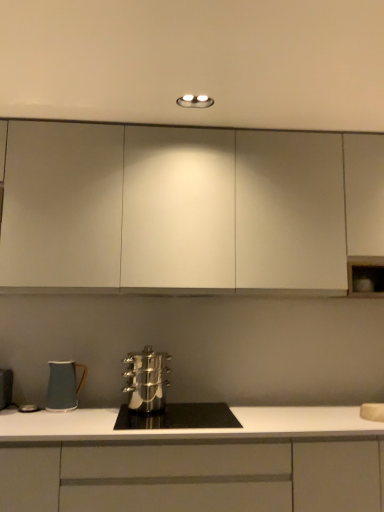
Question: Which direction should I rotate to look at white matte cabinet at center, the second cabinetry viewed from the top, — up or down?

Choices:
 (A) up
 (B) down

Answer: (B)

Question: Are white matte cabinet at center, which is the first cabinetry in bottom-to-top order, and white matte cabinet at upper center, the second cabinetry in the bottom-to-top sequence, far apart?

Choices:
 (A) no
 (B) yes

Answer: (B)

Question: Is white matte cabinet at center, the second cabinetry viewed from the top, facing away from white matte cabinet at upper center, the second cabinetry in the bottom-to-top sequence?

Choices:
 (A) yes
 (B) no

Answer: (B)

Question: Is white matte cabinet at center, which is the first cabinetry in bottom-to-top order, directly adjacent to white matte cabinet at upper center, the first cabinetry in the top-to-bottom sequence?

Choices:
 (A) yes
 (B) no

Answer: (B)

Question: From a real-world perspective, is white matte cabinet at center, the second cabinetry viewed from the top, under white matte cabinet at upper center, the second cabinetry in the bottom-to-top sequence?

Choices:
 (A) no
 (B) yes

Answer: (B)

Question: From the image's perspective, does white matte cabinet at center, which is the first cabinetry in bottom-to-top order, appear lower than white matte cabinet at upper center, the first cabinetry in the top-to-bottom sequence?

Choices:
 (A) no
 (B) yes

Answer: (B)

Question: Is white matte cabinet at center, the second cabinetry viewed from the top, to the left of white matte cabinet at upper center, the second cabinetry in the bottom-to-top sequence, from the viewer's perspective?

Choices:
 (A) no
 (B) yes

Answer: (A)

Question: Is stainless steel cookware at center oriented away from matte ceramic mug at lower left, the second kitchen appliance positioned from the right?

Choices:
 (A) no
 (B) yes

Answer: (A)

Question: Is stainless steel cookware at center beside matte ceramic mug at lower left, the second kitchen appliance positioned from the right?

Choices:
 (A) yes
 (B) no

Answer: (B)

Question: Can you confirm if stainless steel cookware at center is thinner than matte ceramic mug at lower left, marked as the first kitchen appliance in a left-to-right arrangement?

Choices:
 (A) yes
 (B) no

Answer: (B)

Question: Can you confirm if stainless steel cookware at center is wider than matte ceramic mug at lower left, the second kitchen appliance positioned from the right?

Choices:
 (A) no
 (B) yes

Answer: (B)

Question: Is stainless steel cookware at center bigger than matte ceramic mug at lower left, the second kitchen appliance positioned from the right?

Choices:
 (A) no
 (B) yes

Answer: (B)

Question: Is stainless steel cookware at center taller than matte ceramic mug at lower left, the second kitchen appliance positioned from the right?

Choices:
 (A) yes
 (B) no

Answer: (B)

Question: Does stainless steel cookware at center have a lesser width compared to white matte cabinet at center, which is the first cabinetry in bottom-to-top order?

Choices:
 (A) yes
 (B) no

Answer: (A)